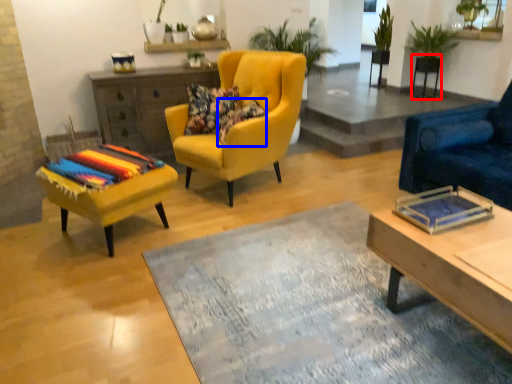
Question: Which point is closer to the camera, side table (highlighted by a red box) or pillow (highlighted by a blue box)?

Choices:
 (A) side table
 (B) pillow

Answer: (B)